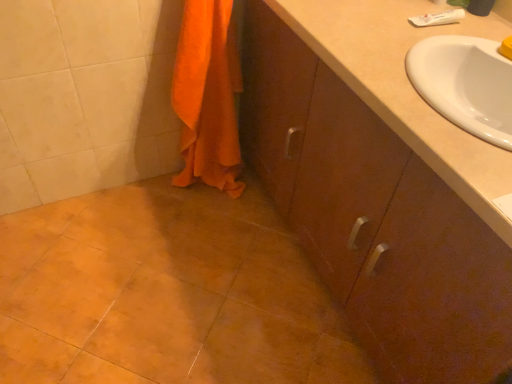
Find the location of a particular element. free space in front of orange cotton towel at lower left is located at coordinates (203, 229).